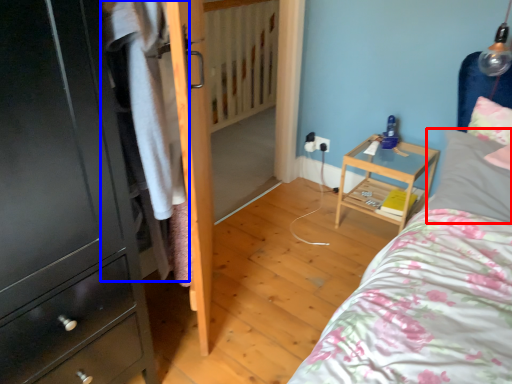
Question: Which object appears closest to the camera in this image, pillow (highlighted by a red box) or clothing (highlighted by a blue box)?

Choices:
 (A) pillow
 (B) clothing

Answer: (B)